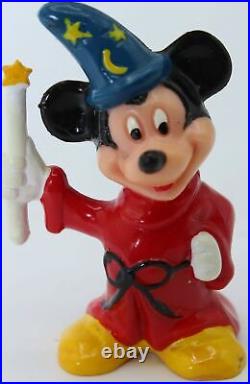
Image resolution: width=250 pixels, height=384 pixels. I want to click on mickey mouse figure, so click(168, 105).